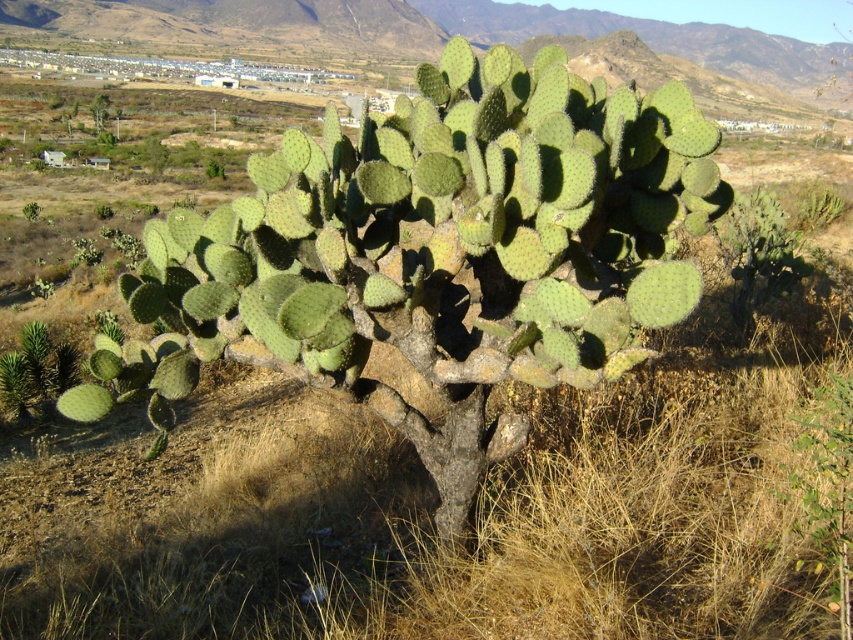
Question: Is green spiny cactus at center closer to camera compared to green spiny cactus at upper left?

Choices:
 (A) yes
 (B) no

Answer: (A)

Question: Among these objects, which one is farthest from the camera?

Choices:
 (A) green spiny cactus at upper left
 (B) green spiny cactus at center

Answer: (A)

Question: Is green spiny cactus at center to the left of green spiny cactus at upper left from the viewer's perspective?

Choices:
 (A) no
 (B) yes

Answer: (A)

Question: Can you confirm if green spiny cactus at center is positioned below green spiny cactus at upper left?

Choices:
 (A) no
 (B) yes

Answer: (B)